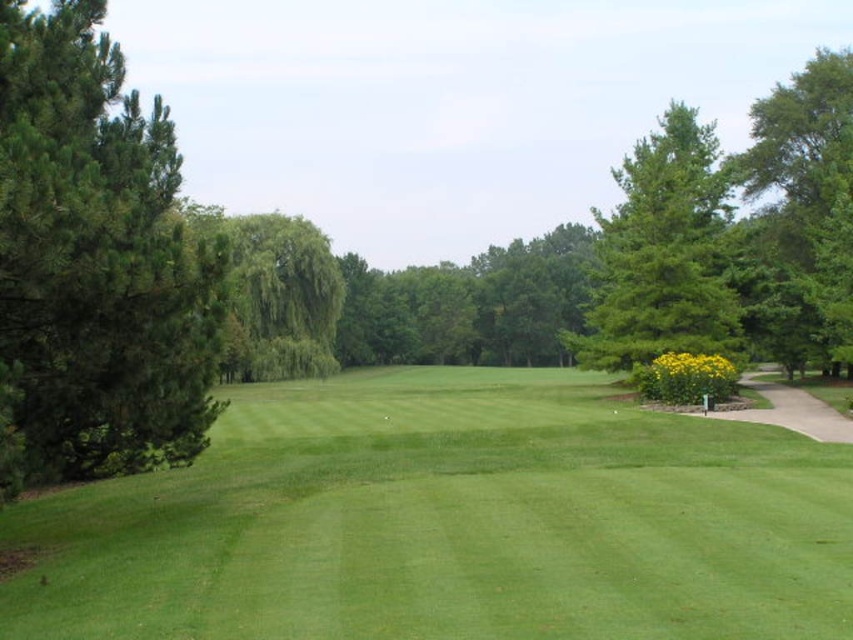
Can you confirm if green smooth grass at center is positioned to the right of green leafy tree at center?

Yes, green smooth grass at center is to the right of green leafy tree at center.

This screenshot has height=640, width=853. Describe the element at coordinates (450, 522) in the screenshot. I see `green smooth grass at center` at that location.

What do you see at coordinates (450, 522) in the screenshot?
I see `green smooth grass at center` at bounding box center [450, 522].

The image size is (853, 640). What are the coordinates of `green smooth grass at center` in the screenshot? It's located at (450, 522).

Between point (62, 113) and point (786, 216), which one is positioned in front?

Point (62, 113) is in front.

Can you confirm if green needle-like at left is taller than green leafy tree at right?

In fact, green needle-like at left may be shorter than green leafy tree at right.

The width and height of the screenshot is (853, 640). Describe the element at coordinates (96, 264) in the screenshot. I see `green needle-like at left` at that location.

I want to click on green needle-like at left, so click(x=96, y=264).

Who is lower down, green needle-like at left or green matte tree at upper right?

green needle-like at left is lower down.

Does green needle-like at left appear on the left side of green matte tree at upper right?

Yes, green needle-like at left is to the left of green matte tree at upper right.

Between point (59, 74) and point (717, 188), which one is positioned behind?

The point (717, 188) is more distant.

Identify the location of green needle-like at left. (96, 264).